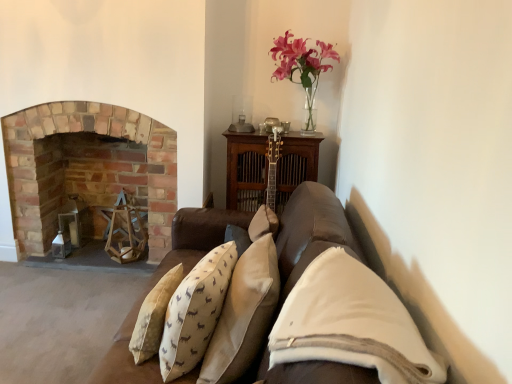
Question: Is brick fireplace at left far away from pink glass vase at upper center?

Choices:
 (A) yes
 (B) no

Answer: (A)

Question: Is brick fireplace at left directly adjacent to pink glass vase at upper center?

Choices:
 (A) no
 (B) yes

Answer: (A)

Question: Is the depth of brick fireplace at left greater than that of pink glass vase at upper center?

Choices:
 (A) no
 (B) yes

Answer: (B)

Question: Is brick fireplace at left smaller than pink glass vase at upper center?

Choices:
 (A) no
 (B) yes

Answer: (A)

Question: Does brick fireplace at left have a lesser height compared to pink glass vase at upper center?

Choices:
 (A) no
 (B) yes

Answer: (A)

Question: Is brick fireplace at left inside the boundaries of beige velvet pillow at center, positioned as the third pillow in right-to-left order, or outside?

Choices:
 (A) inside
 (B) outside

Answer: (B)

Question: Is brick fireplace at left wider or thinner than beige velvet pillow at center, the first pillow viewed from the left?

Choices:
 (A) thin
 (B) wide

Answer: (B)

Question: Considering the positions of brick fireplace at left and beige velvet pillow at center, the first pillow viewed from the left, in the image, is brick fireplace at left bigger or smaller than beige velvet pillow at center, the first pillow viewed from the left,?

Choices:
 (A) big
 (B) small

Answer: (A)

Question: From a real-world perspective, is brick fireplace at left physically located above or below beige velvet pillow at center, positioned as the third pillow in right-to-left order?

Choices:
 (A) below
 (B) above

Answer: (A)

Question: Is pink glass vase at upper center wider or thinner than white soft pillow at center, which is the 1th pillow in right-to-left order?

Choices:
 (A) thin
 (B) wide

Answer: (B)

Question: Is pink glass vase at upper center inside the boundaries of white soft pillow at center, which is the 1th pillow in right-to-left order, or outside?

Choices:
 (A) outside
 (B) inside

Answer: (A)

Question: From a real-world perspective, is pink glass vase at upper center above or below white soft pillow at center, which is the 1th pillow in right-to-left order?

Choices:
 (A) above
 (B) below

Answer: (A)

Question: Looking at the image, does pink glass vase at upper center seem bigger or smaller compared to white soft pillow at center, the third pillow viewed from the left?

Choices:
 (A) small
 (B) big

Answer: (B)

Question: From the image's perspective, is beige velvet pillow at center, the first pillow viewed from the left, located above or below brick fireplace at left?

Choices:
 (A) above
 (B) below

Answer: (B)

Question: Would you say beige velvet pillow at center, positioned as the third pillow in right-to-left order, is to the left or to the right of brick fireplace at left in the picture?

Choices:
 (A) left
 (B) right

Answer: (B)